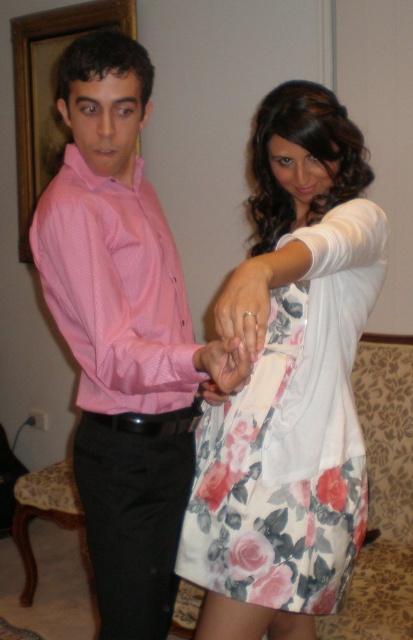
You are a photographer setting up a shoot in this living room. You need to place a small prop between the pink shirt at left and the matte white ring at center. Based on their positions, where should you place the prop to ensure it is between them?

The pink shirt at left is located above the matte white ring at center, so placing the prop between them would require positioning it below the pink shirt at left and above the matte white ring at center.

You are a photographer setting up a shoot in this living room. You need to position a light source so that it illuminates the floral cotton dress at center without casting a shadow on the black leather belt at lower center. Given their spatial relationship, where should you place the light source relative to the dress and belt?

The floral cotton dress at center is closer to the viewer than the black leather belt at lower center. To avoid casting a shadow on the belt, the light source should be placed behind the dress, facing towards it. This way, the dress will be illuminated while its proximity to the viewer ensures the belt remains in shadow.

You are a photographer setting up a shot in this living room scene. You need to focus on the pink shirt at left and the matte white ring at center. Which object should you adjust your camera to focus on first if you want to capture both in sharp detail?

The pink shirt at left is closer to the viewer than the matte white ring at center, so you should focus on the pink shirt at left first to ensure both are in sharp detail.